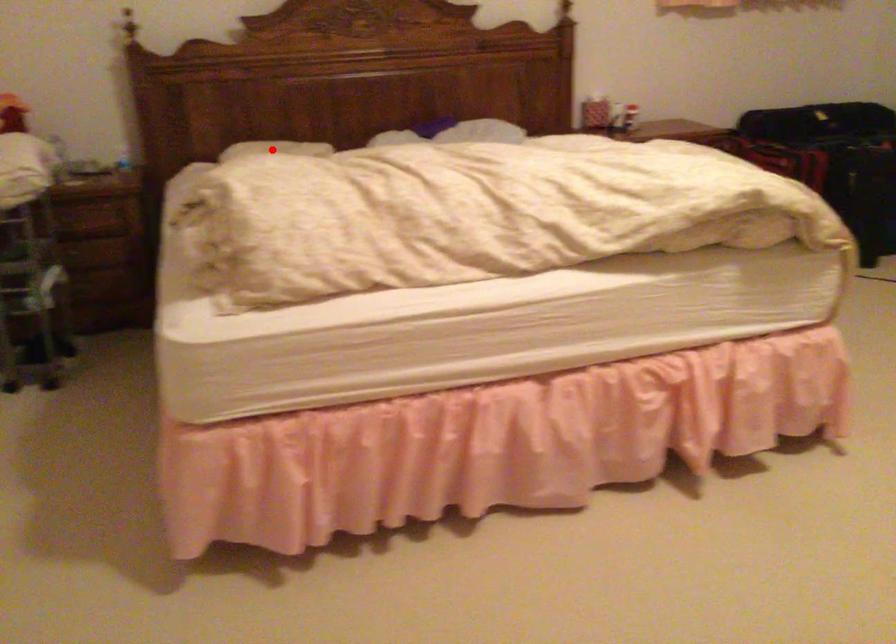
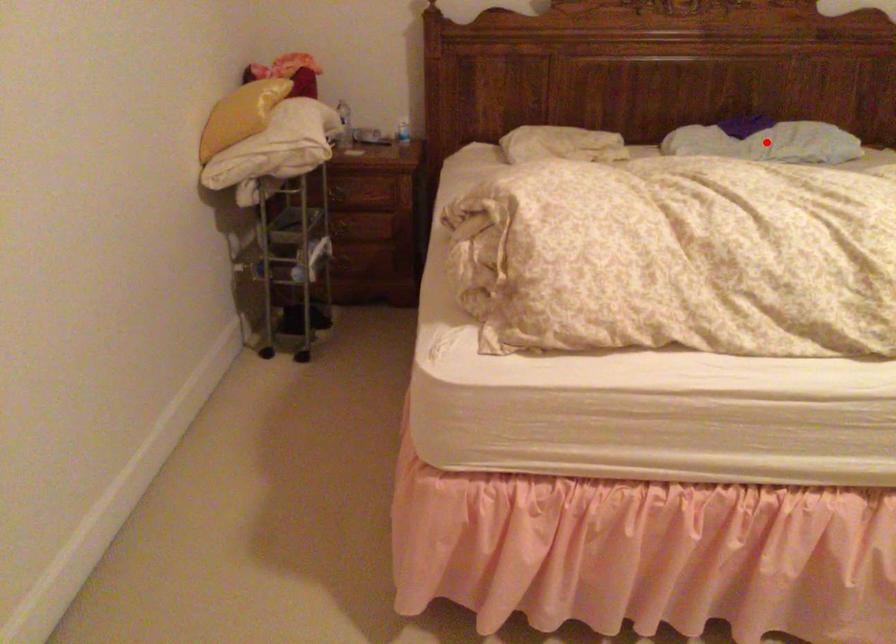
Consider the image. I am providing you with two images of the same scene from different viewpoints. A red point is marked on the first image and another point is marked on the second image. Is the marked point in image1 the same physical position as the marked point in image2?

No